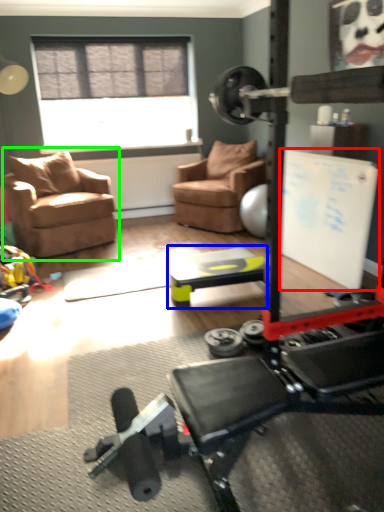
Question: Based on their relative distances, which object is farther from bulletin board (highlighted by a red box)? Choose from table (highlighted by a blue box) and chair (highlighted by a green box).

Choices:
 (A) table
 (B) chair

Answer: (B)